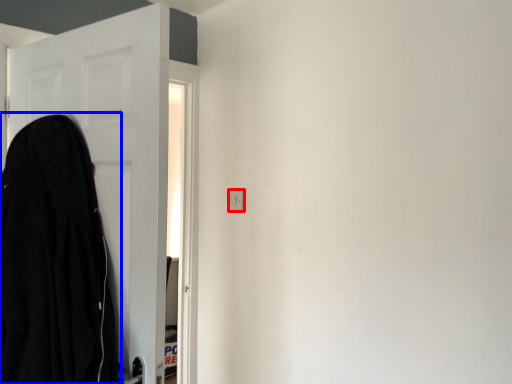
Question: Among these objects, which one is nearest to the camera, electric outlet (highlighted by a red box) or cloak (highlighted by a blue box)?

Choices:
 (A) electric outlet
 (B) cloak

Answer: (B)